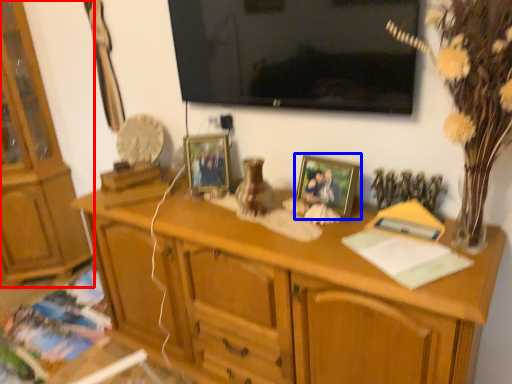
Question: Which point is closer to the camera, cabinetry (highlighted by a red box) or picture frame (highlighted by a blue box)?

Choices:
 (A) cabinetry
 (B) picture frame

Answer: (B)